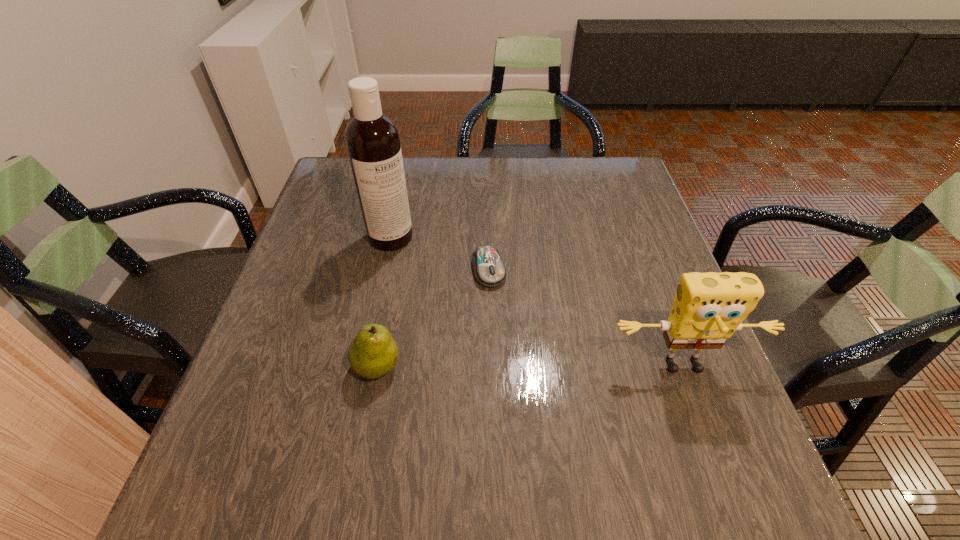
Find the location of a particular element. free space located 0.240m on the label side of the tallest object is located at coordinates (466, 303).

Identify the location of vacant point located on the label side of the tallest object. (433, 274).

Where is `free space located 0.140m on the wheel side of the third nearest object`? The image size is (960, 540). free space located 0.140m on the wheel side of the third nearest object is located at coordinates (508, 337).

Identify the location of free space located on the wheel side of the third nearest object. (501, 315).

Where is `free space located 0.110m on the wheel side of the third nearest object`? This screenshot has height=540, width=960. free space located 0.110m on the wheel side of the third nearest object is located at coordinates (504, 326).

Locate an element on the screen. The height and width of the screenshot is (540, 960). object present at the right edge is located at coordinates (709, 307).

You are a GUI agent. You are given a task and a screenshot of the screen. Output one action in this format:
    pyautogui.click(x=<x>, y=<y>)
    Task: Click on the vacant region at the far edge of the desktop
    
    Given the screenshot: What is the action you would take?
    pyautogui.click(x=509, y=194)

You are a GUI agent. You are given a task and a screenshot of the screen. Output one action in this format:
    pyautogui.click(x=<x>, y=<y>)
    Task: Click on the vacant space at the near edge of the desktop
    The image size is (960, 540).
    Given the screenshot: What is the action you would take?
    pyautogui.click(x=495, y=436)

Where is `vacant space at the left edge of the desktop`? vacant space at the left edge of the desktop is located at coordinates (347, 256).

Image resolution: width=960 pixels, height=540 pixels. I want to click on free space at the right edge, so click(622, 262).